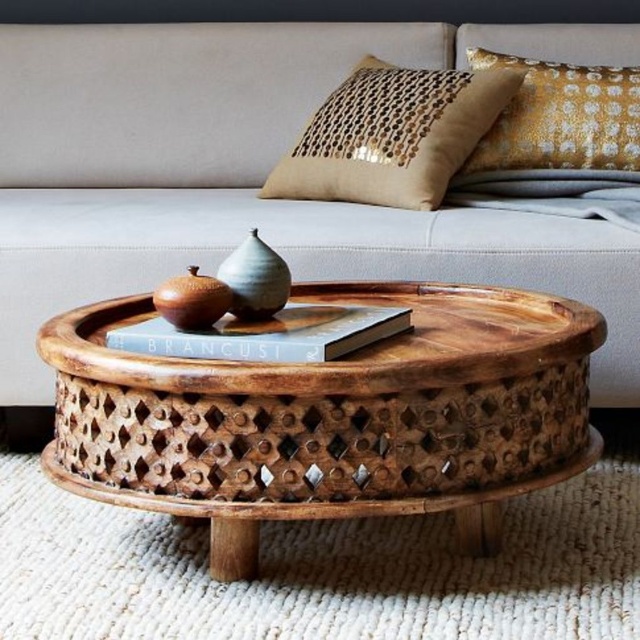
What are the coordinates of `natural wood carved coffee table at center` in the screenshot? It's located at (332, 417).

Between point (348, 515) and point (320, 312), which one is positioned behind?

The point (320, 312) is more distant.

Who is more distant from viewer, [67,474] or [202,348]?

Point [67,474]

The width and height of the screenshot is (640, 640). What are the coordinates of `natural wood carved coffee table at center` in the screenshot? It's located at (332, 417).

Is natural wood carved coffee table at center above gold sequined pillow at upper right?

Actually, natural wood carved coffee table at center is below gold sequined pillow at upper right.

Which is behind, point (332, 468) or point (438, 128)?

The point (438, 128) is behind.

Consider the image. Who is more forward, [353,468] or [314,196]?

Positioned in front is point [353,468].

At what (x,y) coordinates should I click in order to perform the action: click on natural wood carved coffee table at center. Please return your answer as a coordinate pair (x, y). The width and height of the screenshot is (640, 640). Looking at the image, I should click on (332, 417).

Is point (92, 204) more distant than point (291, 410)?

Yes, point (92, 204) is behind point (291, 410).

Who is taller, neutral fabric couch at center or natural wood carved coffee table at center?

Standing taller between the two is neutral fabric couch at center.

Who is more distant from viewer, (36, 161) or (241, 445)?

The point (36, 161) is behind.

Image resolution: width=640 pixels, height=640 pixels. Find the location of `neutral fabric couch at center`. neutral fabric couch at center is located at coordinates (266, 173).